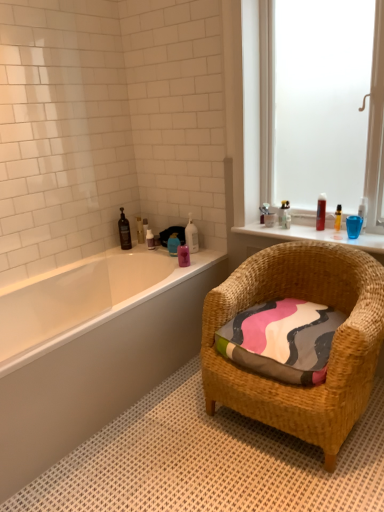
Image resolution: width=384 pixels, height=512 pixels. Identify the location of vacant area situated to the left side of translucent plastic bottle at upper right, which is the tenth toiletry in left-to-right order. (294, 230).